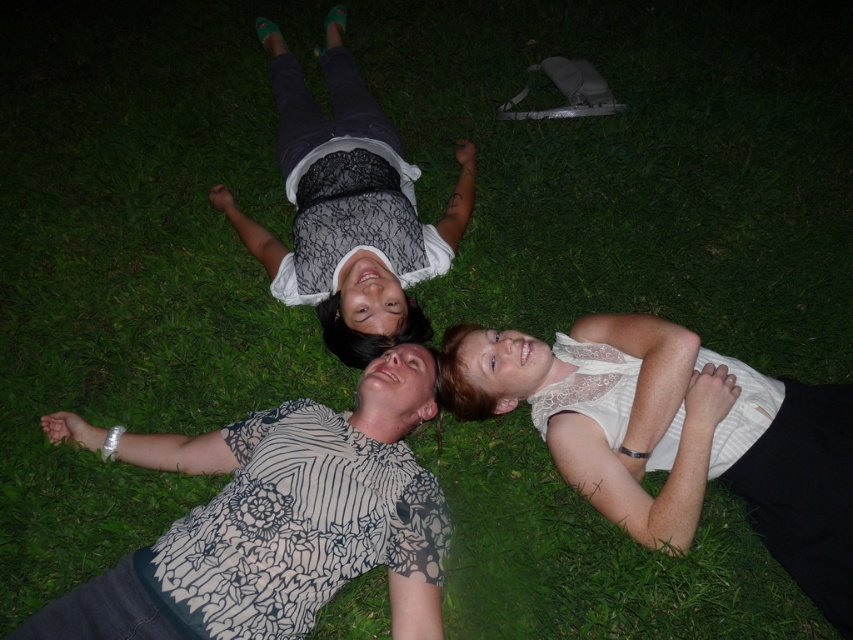
Between white lace tank top at center and matte black shirt at upper center, which one appears on the left side from the viewer's perspective?

matte black shirt at upper center

Is white lace tank top at center below matte black shirt at upper center?

Correct, white lace tank top at center is located below matte black shirt at upper center.

Does point (770, 406) come behind point (354, 292)?

No, it is in front of (354, 292).

Find the location of `white lace tank top at center`. white lace tank top at center is located at coordinates (675, 436).

Does white lace shirt at center appear over white lace tank top at center?

Actually, white lace shirt at center is below white lace tank top at center.

Is point (128, 609) positioned after point (666, 392)?

No, it is in front of (666, 392).

Between point (55, 422) and point (665, 358), which one is positioned behind?

The point (55, 422) is more distant.

I want to click on white lace shirt at center, so click(x=281, y=522).

Identify the location of white lace shirt at center. This screenshot has width=853, height=640. (281, 522).

Measure the distance between white lace shirt at center and camera.

They are 5.11 feet apart.

Does point (341, 560) lie in front of point (346, 193)?

Yes, point (341, 560) is in front of point (346, 193).

Identify the location of white lace shirt at center. The image size is (853, 640). (281, 522).